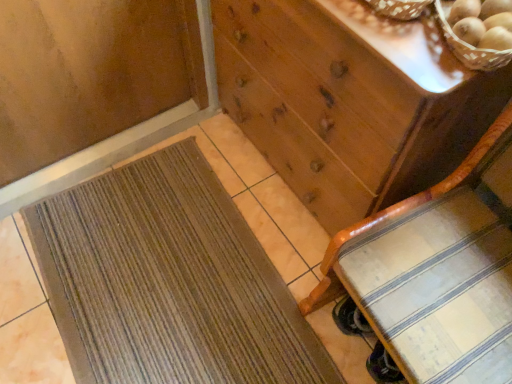
What do you see at coordinates (470, 46) in the screenshot? I see `wooden woven basket at upper right` at bounding box center [470, 46].

What do you see at coordinates (347, 102) in the screenshot? The height and width of the screenshot is (384, 512). I see `wooden chest of drawers at center` at bounding box center [347, 102].

In order to click on wooden chair at lower right in this screenshot , I will do click(437, 271).

Where is `wooden woven basket at upper right`? This screenshot has height=384, width=512. wooden woven basket at upper right is located at coordinates (470, 46).

From a real-world perspective, between wooden chest of drawers at center and wooden chair at lower right, who is vertically lower?

wooden chest of drawers at center.

Can you tell me how much wooden chest of drawers at center and wooden chair at lower right differ in facing direction?

The angle between the facing direction of wooden chest of drawers at center and the facing direction of wooden chair at lower right is 6 degrees.

Can you confirm if wooden chest of drawers at center is bigger than wooden chair at lower right?

Yes.

Is wooden chest of drawers at center taller than wooden chair at lower right?

No.

Looking at this image, is wooden chair at lower right at the left side of wooden chest of drawers at center?

No.

Is wooden chair at lower right far from wooden chest of drawers at center?

Actually, wooden chair at lower right and wooden chest of drawers at center are a little close together.

Which object is closer to the camera taking this photo, wooden chair at lower right or wooden chest of drawers at center?

wooden chair at lower right is closer to the camera.

Does wooden chair at lower right have a lesser width compared to wooden chest of drawers at center?

No.

Would you say wooden woven basket at upper right is inside or outside wooden chair at lower right?

wooden woven basket at upper right lies outside wooden chair at lower right.

Does wooden woven basket at upper right have a greater width compared to wooden chair at lower right?

No.

From a real-world perspective, between wooden woven basket at upper right and wooden chair at lower right, who is vertically higher?

In real-world perspective, wooden woven basket at upper right is above.

In the scene shown: From the image's perspective, is wooden woven basket at upper right above wooden chair at lower right?

Yes, from the image's perspective, wooden woven basket at upper right is above wooden chair at lower right.

Is brown textured mat at lower left facing towards wooden woven basket at upper right?

No.

From the image's perspective, which object appears higher, brown textured mat at lower left or wooden woven basket at upper right?

wooden woven basket at upper right.

Does point (288, 355) come in front of point (485, 70)?

That is False.

From a real-world perspective, which is physically below, brown textured mat at lower left or wooden woven basket at upper right?

From a 3D spatial view, brown textured mat at lower left is below.

Are wooden chair at lower right and brown textured mat at lower left beside each other?

wooden chair at lower right and brown textured mat at lower left are not in contact.

Consider the image. Which of these two, wooden chair at lower right or brown textured mat at lower left, stands shorter?

brown textured mat at lower left is shorter.

From the image's perspective, which object appears higher, wooden chair at lower right or brown textured mat at lower left?

wooden chair at lower right, from the image's perspective.

Identify the location of mat that appears on the left of wooden chair at lower right. This screenshot has height=384, width=512. [x=168, y=281].

From their relative heights in the image, would you say wooden woven basket at upper right is taller or shorter than wooden chest of drawers at center?

wooden woven basket at upper right is shorter than wooden chest of drawers at center.

Is point (450, 31) in front of point (439, 119)?

Yes.

Does wooden woven basket at upper right have a lesser width compared to wooden chest of drawers at center?

Yes.

Is wooden chair at lower right taller or shorter than wooden woven basket at upper right?

Considering their sizes, wooden chair at lower right has more height than wooden woven basket at upper right.

From a real-world perspective, is wooden chair at lower right located higher than wooden woven basket at upper right?

Actually, wooden chair at lower right is physically below wooden woven basket at upper right in the real world.

Is wooden chair at lower right positioned with its back to wooden woven basket at upper right?

No, wooden woven basket at upper right is not at the back of wooden chair at lower right.

Which is correct: wooden chair at lower right is inside wooden woven basket at upper right, or outside of it?

wooden chair at lower right is outside wooden woven basket at upper right.

I want to click on the chest of drawers located underneath the wooden chair at lower right (from a real-world perspective), so click(x=347, y=102).

I want to click on furniture on the right of wooden chest of drawers at center, so click(x=437, y=271).

Based on their spatial positions, is wooden woven basket at upper right or wooden chest of drawers at center closer to wooden chair at lower right?

Based on the image, wooden chest of drawers at center appears to be nearer to wooden chair at lower right.

From the image, which object appears to be farther from wooden chair at lower right, brown textured mat at lower left or wooden woven basket at upper right?

Based on the image, brown textured mat at lower left appears to be further to wooden chair at lower right.

From the image, which object appears to be farther from wooden chair at lower right, wooden chest of drawers at center or brown textured mat at lower left?

brown textured mat at lower left lies further to wooden chair at lower right than the other object.

From the image, which object appears to be farther from brown textured mat at lower left, wooden chair at lower right or wooden chest of drawers at center?

wooden chest of drawers at center lies further to brown textured mat at lower left than the other object.

From the image, which object appears to be nearer to wooden woven basket at upper right, brown textured mat at lower left or wooden chest of drawers at center?

wooden chest of drawers at center lies closer to wooden woven basket at upper right than the other object.

From the image, which object appears to be farther from brown textured mat at lower left, wooden chair at lower right or wooden woven basket at upper right?

wooden woven basket at upper right.

Based on their spatial positions, is wooden chair at lower right or wooden chest of drawers at center closer to wooden woven basket at upper right?

Among the two, wooden chest of drawers at center is located nearer to wooden woven basket at upper right.

From the picture: Which object lies nearer to the anchor point wooden chest of drawers at center, wooden woven basket at upper right or wooden chair at lower right?

wooden chair at lower right.

Identify the location of the chest of drawers between wooden woven basket at upper right and brown textured mat at lower left vertically. (347, 102).

This screenshot has height=384, width=512. I want to click on chest of drawers between wooden woven basket at upper right and wooden chair at lower right in the vertical direction, so click(347, 102).

The image size is (512, 384). In order to click on basket between brown textured mat at lower left and wooden chair at lower right in the horizontal direction in this screenshot , I will do `click(470, 46)`.

This screenshot has height=384, width=512. In order to click on chest of drawers between brown textured mat at lower left and wooden chair at lower right in this screenshot , I will do `click(347, 102)`.